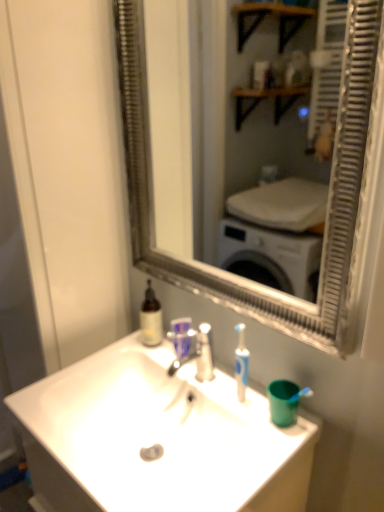
Question: From a real-world perspective, is silver metallic faucet at center on translucent plastic mouthwash at center?

Choices:
 (A) no
 (B) yes

Answer: (B)

Question: From the image's perspective, is silver metallic faucet at center beneath translucent plastic mouthwash at center?

Choices:
 (A) yes
 (B) no

Answer: (A)

Question: Considering the relative sizes of silver metallic faucet at center and translucent plastic mouthwash at center in the image provided, is silver metallic faucet at center wider than translucent plastic mouthwash at center?

Choices:
 (A) no
 (B) yes

Answer: (B)

Question: Does silver metallic faucet at center have a lesser height compared to translucent plastic mouthwash at center?

Choices:
 (A) no
 (B) yes

Answer: (A)

Question: Is translucent plastic mouthwash at center inside silver metallic faucet at center?

Choices:
 (A) no
 (B) yes

Answer: (A)

Question: Is silver metallic faucet at center not inside translucent plastic mouthwash at center?

Choices:
 (A) yes
 (B) no

Answer: (A)

Question: From the image's perspective, is silver metallic faucet at center located above silver metallic mirror at center?

Choices:
 (A) yes
 (B) no

Answer: (B)

Question: Can you confirm if silver metallic faucet at center is taller than silver metallic mirror at center?

Choices:
 (A) yes
 (B) no

Answer: (B)

Question: Could silver metallic mirror at center be considered to be inside silver metallic faucet at center?

Choices:
 (A) yes
 (B) no

Answer: (B)

Question: Considering the relative sizes of silver metallic faucet at center and silver metallic mirror at center in the image provided, is silver metallic faucet at center bigger than silver metallic mirror at center?

Choices:
 (A) no
 (B) yes

Answer: (A)

Question: From the image's perspective, is silver metallic faucet at center located beneath silver metallic mirror at center?

Choices:
 (A) yes
 (B) no

Answer: (A)

Question: From a real-world perspective, is silver metallic faucet at center on top of silver metallic mirror at center?

Choices:
 (A) no
 (B) yes

Answer: (A)

Question: Does silver metallic mirror at center have a larger size compared to white glossy sink at center?

Choices:
 (A) yes
 (B) no

Answer: (B)